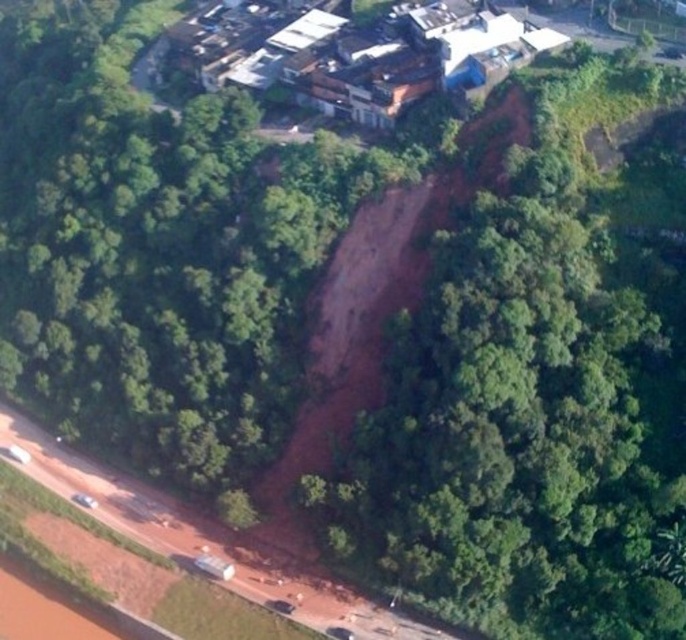
You are a drone operator flying over the landscape. You need to capture a clear photo of the brown wooden houses at upper center without the brown dirt cliff at center blocking the view. Is this possible based on their positions?

The brown dirt cliff at center is in front of the brown wooden houses at upper center, so it will block the view. To capture a clear photo without the cliff blocking, you would need to adjust the drone position to fly around or above the cliff.

You are a geologist examining the landscape from above. You notice the brown dirt cliff at center and the brown wooden houses at upper center. Which of these two features has a greater vertical height?

The brown dirt cliff at center is taller than the brown wooden houses at upper center.

You are a geologist analyzing an aerial image of a landscape. You see a point labeled as point (539, 384). Based on the scene description, what natural feature does this point most likely represent?

The point (539, 384) corresponds to a brown dirt cliff at center, which is likely the result of erosion or a landslide causing exposed red soil in the center of the image.